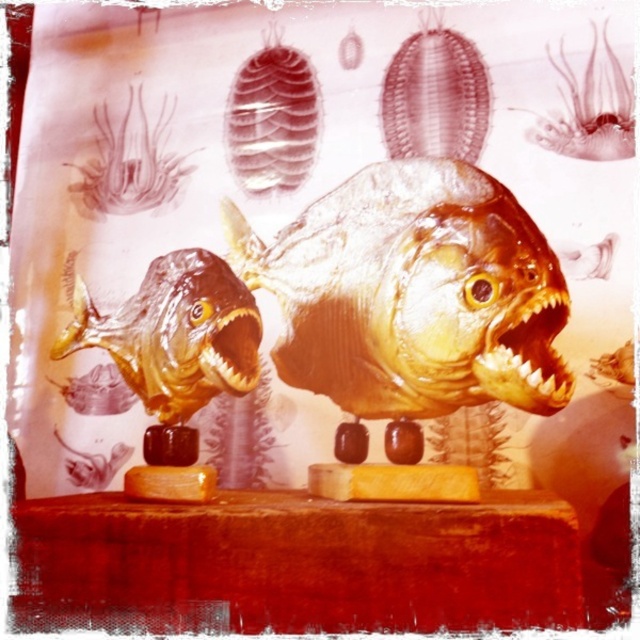
You are an art curator examining the mounted piranha heads. You notice a point marked at coordinates (129,161). Which object does this point correspond to?

The point at (129,161) corresponds to the translucent amber fish at upper left.

You are a visitor at a museum and see the two displayed piranha heads. The shiny gold teeth at center and the translucent amber mouth at center are both in the center. Which one is closer to you?

The shiny gold teeth at center is closer to you because it is in front of the translucent amber mouth at center.